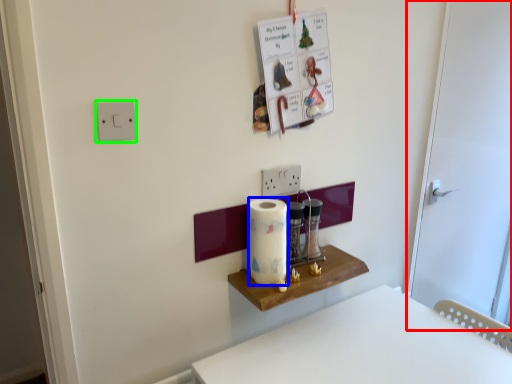
Question: Which is nearer to the door (highlighted by a red box)? paper towel (highlighted by a blue box) or light switch (highlighted by a green box).

Choices:
 (A) paper towel
 (B) light switch

Answer: (A)